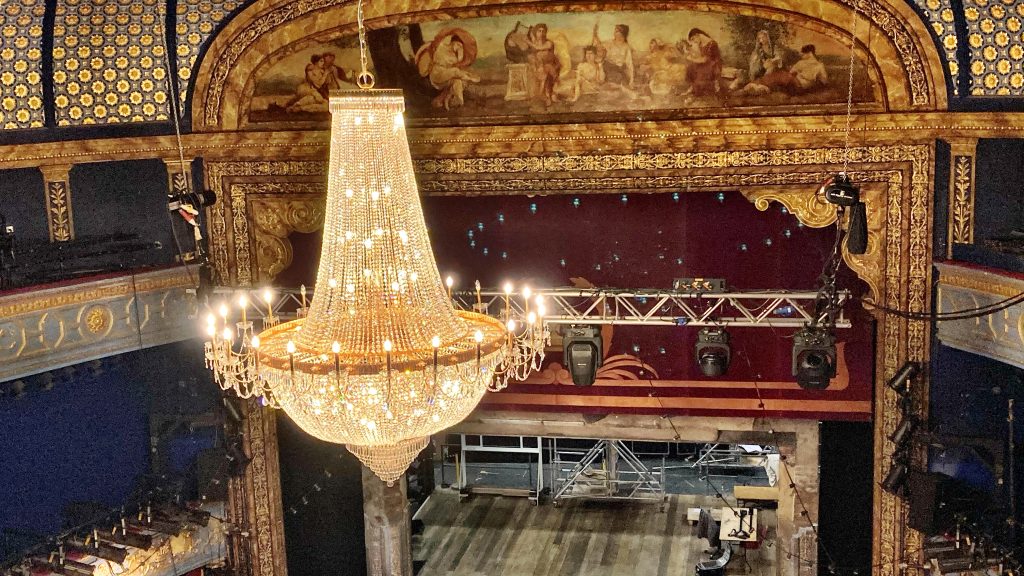
Locate an element on the screen. Image resolution: width=1024 pixels, height=576 pixels. ornate patterns is located at coordinates (40, 337), (920, 147), (911, 343).